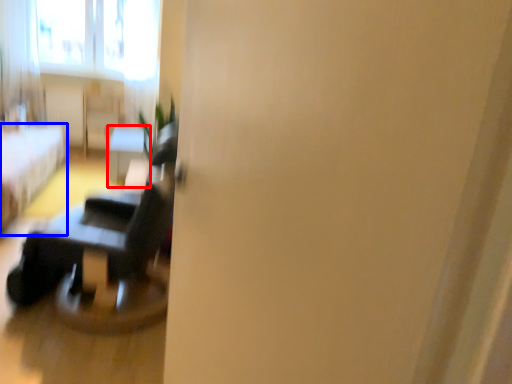
Question: Which point is closer to the camera, table (highlighted by a red box) or furniture (highlighted by a blue box)?

Choices:
 (A) table
 (B) furniture

Answer: (B)